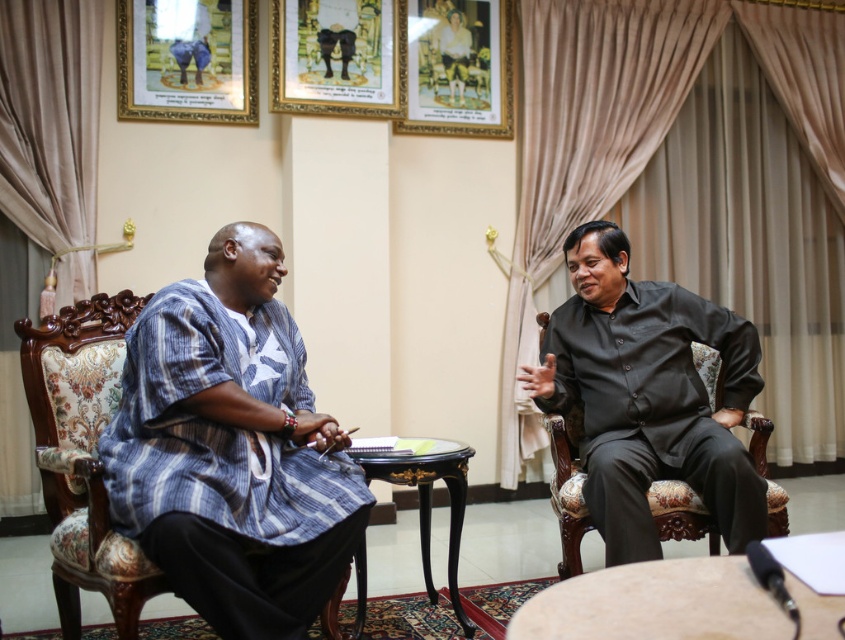
Question: Is blue striped shirt at left wider than black matte shirt at right?

Choices:
 (A) yes
 (B) no

Answer: (B)

Question: Does wooden framed portrait at upper center have a smaller size compared to black lacquered table at center?

Choices:
 (A) yes
 (B) no

Answer: (A)

Question: Which object appears closest to the camera in this image?

Choices:
 (A) light brown wooden round table at center
 (B) black matte shirt at right
 (C) black lacquered table at center
 (D) wooden framed portrait at upper center

Answer: (A)

Question: Can you confirm if wooden framed portrait at upper center is positioned to the left of black lacquered table at center?

Choices:
 (A) yes
 (B) no

Answer: (B)

Question: Which point is farther to the camera?

Choices:
 (A) black lacquered table at center
 (B) blue striped shirt at left
 (C) light brown wooden round table at center

Answer: (A)

Question: Which point is closer to the camera?

Choices:
 (A) matte wooden picture frame at upper left
 (B) wooden framed portrait at upper center

Answer: (A)